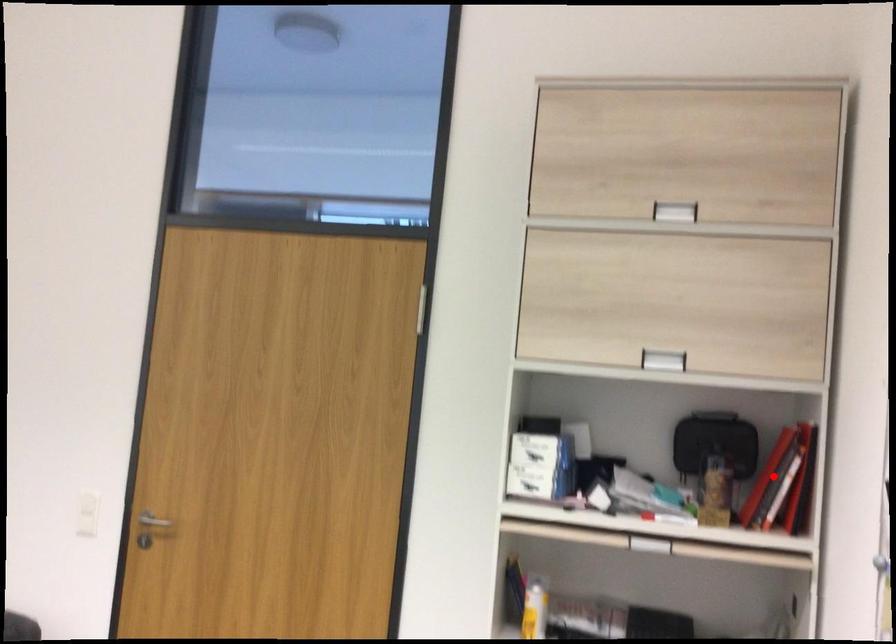
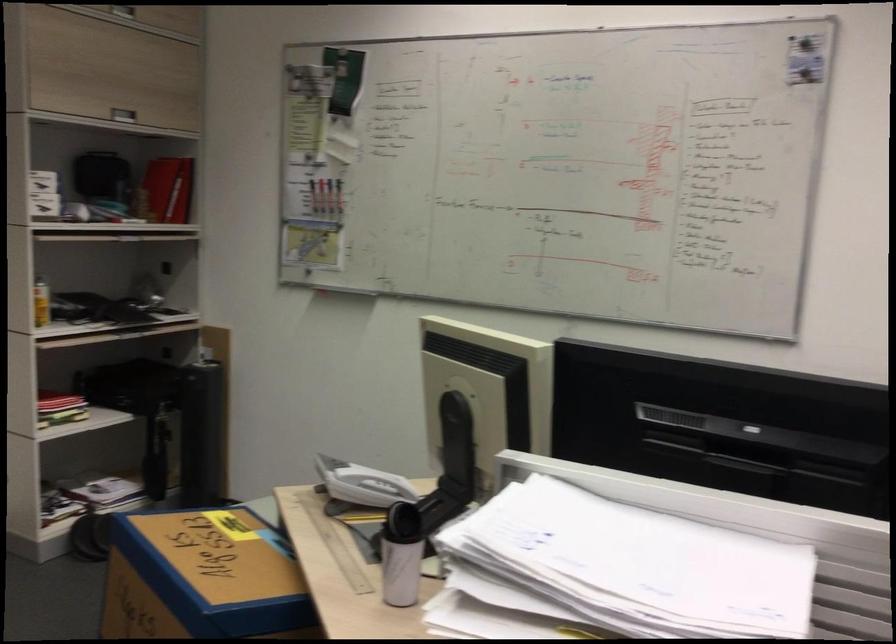
The point at the highlighted location is marked in the first image. Where is the corresponding point in the second image?

(166, 190)